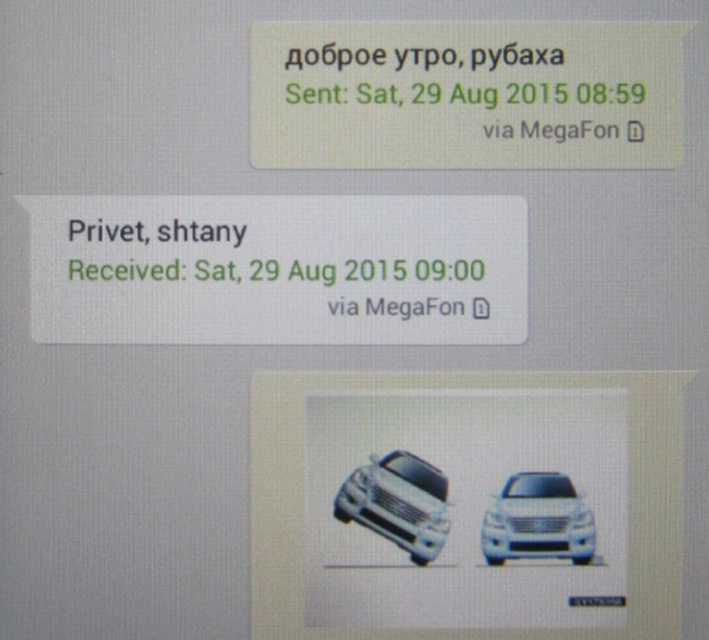
Is white glossy suv at center in front of white glossy car at center?

No, it is behind white glossy car at center.

Between point (359, 493) and point (579, 557), which one is positioned behind?

Point (359, 493)

Does point (376, 490) come behind point (486, 561)?

Yes.

Find the location of a particular element. The width and height of the screenshot is (709, 640). white glossy suv at center is located at coordinates (398, 502).

Can you confirm if white paper at center is positioned below green matte text message at upper center?

Yes.

Does white paper at center have a lesser height compared to green matte text message at upper center?

In fact, white paper at center may be taller than green matte text message at upper center.

This screenshot has width=709, height=640. What do you see at coordinates (279, 269) in the screenshot?
I see `white paper at center` at bounding box center [279, 269].

You are a GUI agent. You are given a task and a screenshot of the screen. Output one action in this format:
    pyautogui.click(x=<x>, y=<y>)
    Task: Click on the white paper at center
    The image size is (709, 640).
    Given the screenshot: What is the action you would take?
    pyautogui.click(x=279, y=269)

Between white paper at center and white glossy suv at center, which one is positioned higher?

Positioned higher is white paper at center.

The width and height of the screenshot is (709, 640). Identify the location of white paper at center. [x=279, y=269].